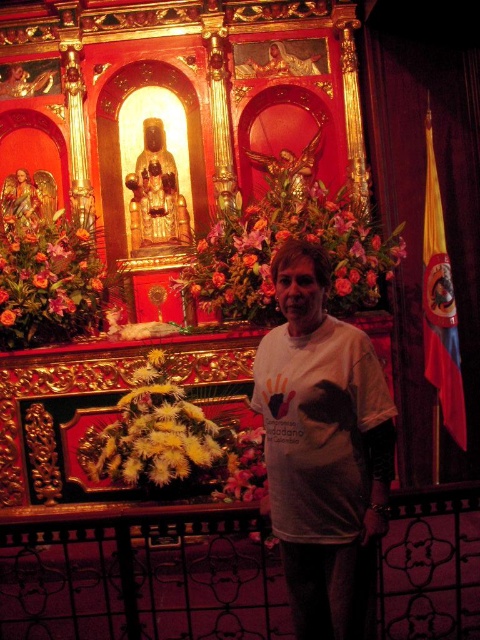
You are a florist who needs to rearrange the floral bouquet at center and the orange floral bouquet at left for a ceremony. The venue requires that the distance between them must be exactly 8 meters. Based on the current setup, will you need to adjust their positions?

The floral bouquet at center and orange floral bouquet at left are currently 8.01 meters apart. Since the required distance is exactly 8 meters, you will need to move them slightly closer to meet the venue requirement.